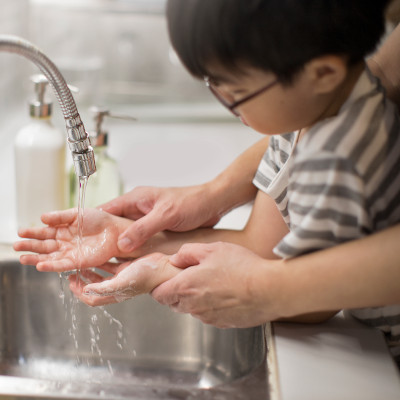
You are a GUI agent. You are given a task and a screenshot of the screen. Output one action in this format:
    pyautogui.click(x=<x>, y=<y>)
    Task: Click on the faucet head
    This screenshot has width=400, height=400.
    Given the screenshot: What is the action you would take?
    pyautogui.click(x=69, y=107)